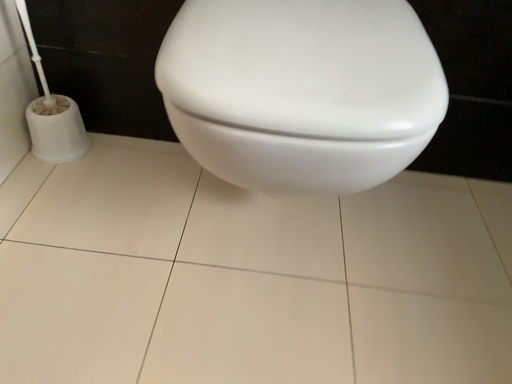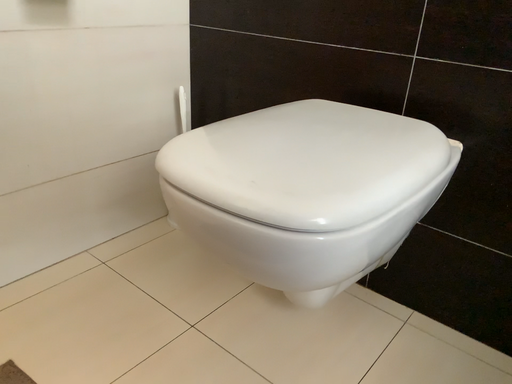
Question: How did the camera likely rotate when shooting the video?

Choices:
 (A) rotated right
 (B) rotated left

Answer: (B)